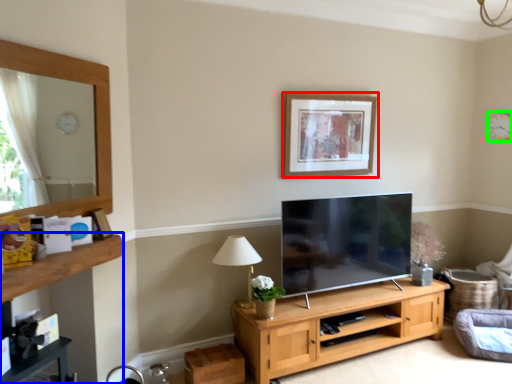
Question: Which object is positioned closest to picture frame (highlighted by a red box)? Select from dresser (highlighted by a blue box) and clock (highlighted by a green box).

Choices:
 (A) dresser
 (B) clock

Answer: (B)